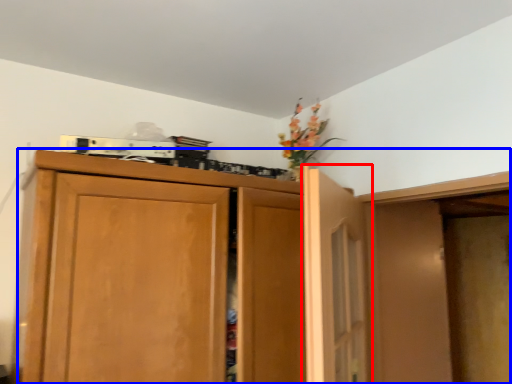
Question: Which of the following is the closest to the observer, door (highlighted by a red box) or cupboard (highlighted by a blue box)?

Choices:
 (A) door
 (B) cupboard

Answer: (A)